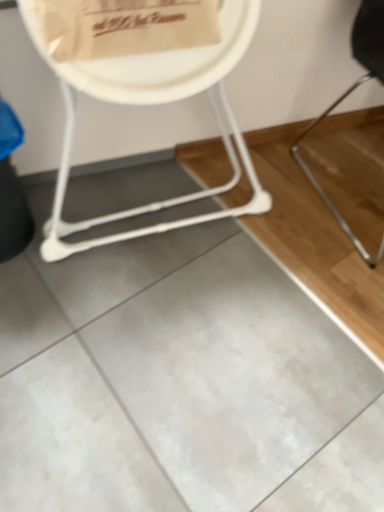
Find the location of `vacant area to the right of white plastic chair at upper left, the 2th chair in the right-to-left sequence`. vacant area to the right of white plastic chair at upper left, the 2th chair in the right-to-left sequence is located at coordinates (290, 239).